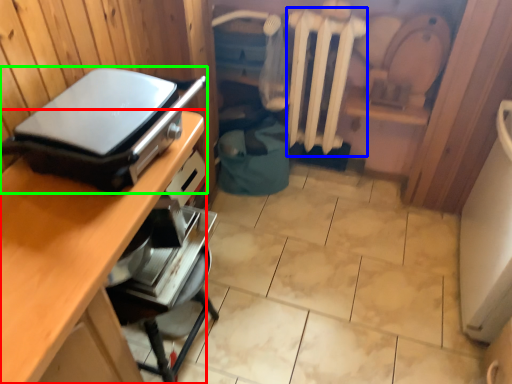
Question: Considering the real-world distances, which object is closest to desk (highlighted by a red box)? radiator (highlighted by a blue box) or appliance (highlighted by a green box).

Choices:
 (A) radiator
 (B) appliance

Answer: (B)